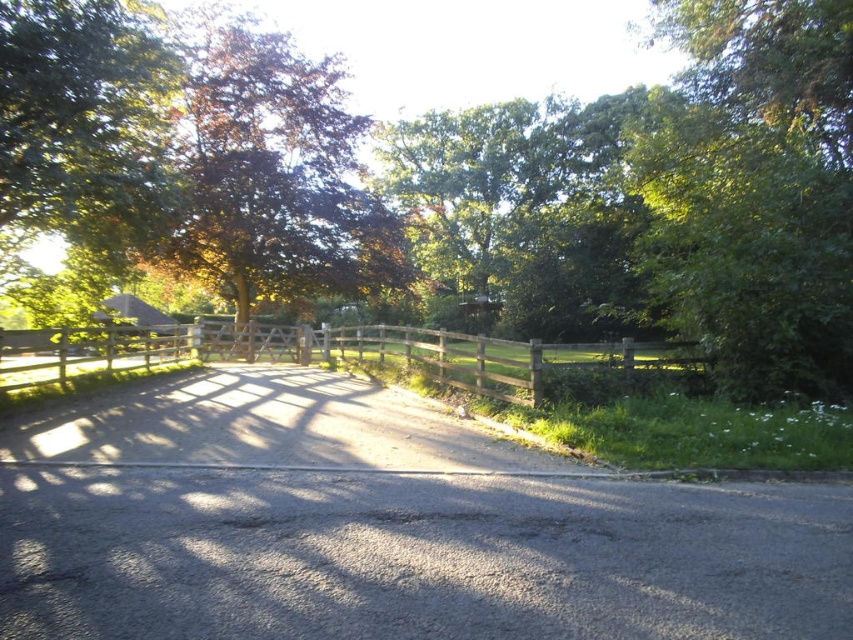
Question: Which object appears farthest from the camera in this image?

Choices:
 (A) brown leafy tree at center
 (B) wooden fence at center
 (C) gray asphalt driveway at center

Answer: (A)

Question: Does gray asphalt driveway at center have a greater width compared to brown leafy tree at center?

Choices:
 (A) yes
 (B) no

Answer: (B)

Question: Is gray asphalt driveway at center further to camera compared to brown leafy tree at center?

Choices:
 (A) yes
 (B) no

Answer: (B)

Question: Can you confirm if brown leafy tree at center is thinner than wooden fence at center?

Choices:
 (A) no
 (B) yes

Answer: (B)

Question: Estimate the real-world distances between objects in this image. Which object is closer to the wooden fence at center?

Choices:
 (A) gray asphalt driveway at center
 (B) green leafy tree at center

Answer: (B)

Question: Which is nearer to the green leafy tree at center?

Choices:
 (A) wooden fence at center
 (B) brown leafy tree at center
 (C) gray asphalt driveway at center

Answer: (A)